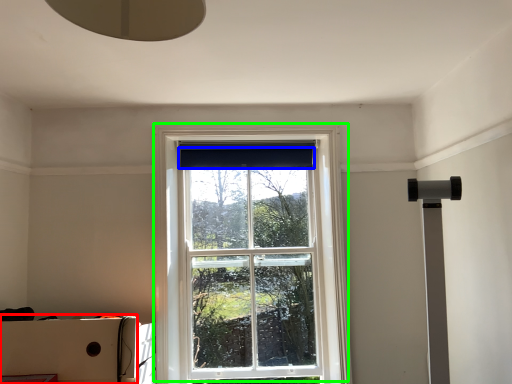
Question: Estimate the real-world distances between objects in this image. Which object is closer to cardboard box (highlighted by a red box), curtain (highlighted by a blue box) or window (highlighted by a green box)?

Choices:
 (A) curtain
 (B) window

Answer: (B)